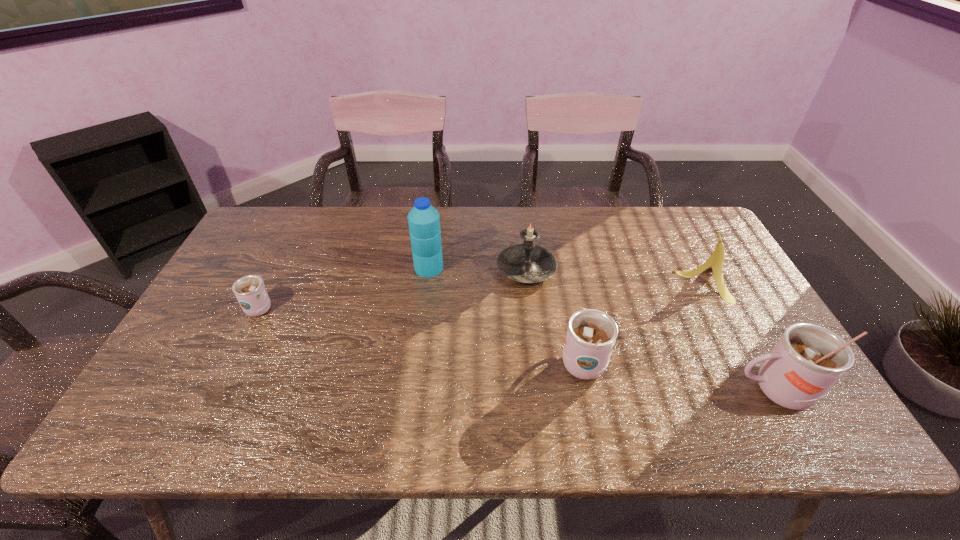
Find the location of a particular element. This screenshot has height=540, width=960. the shortest cup is located at coordinates (250, 292).

Find the location of a particular element. The width and height of the screenshot is (960, 540). the leftmost object is located at coordinates (250, 292).

The image size is (960, 540). I want to click on the second cup from right to left, so click(x=591, y=334).

Where is `the rightmost cup`? This screenshot has height=540, width=960. the rightmost cup is located at coordinates (808, 359).

This screenshot has height=540, width=960. In order to click on banana in this screenshot , I will do `click(715, 262)`.

This screenshot has height=540, width=960. I want to click on candle, so click(x=527, y=263).

Find the location of a particular element. The image size is (960, 540). the second object from left to right is located at coordinates (424, 221).

Where is `free location located 0.280m on the side with the handle of the farthest cup`? This screenshot has height=540, width=960. free location located 0.280m on the side with the handle of the farthest cup is located at coordinates (297, 233).

The height and width of the screenshot is (540, 960). Identify the location of vacant space located 0.280m on the side with the handle of the farthest cup. (297, 233).

Image resolution: width=960 pixels, height=540 pixels. I want to click on free space located 0.220m on the side with the handle of the farthest cup, so click(292, 244).